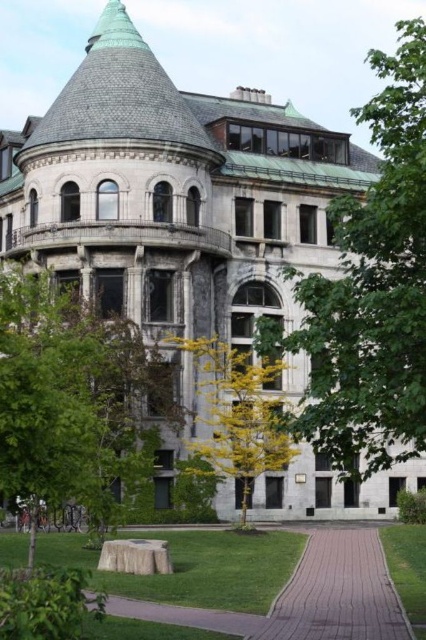
Question: Can you confirm if brick paved path at center is bigger than yellow-green leaves at center?

Choices:
 (A) yes
 (B) no

Answer: (B)

Question: Does brick paved path at center have a smaller size compared to yellow-green leaves at center?

Choices:
 (A) no
 (B) yes

Answer: (B)

Question: Does brick paved path at center appear on the left side of yellow-green leaves at center?

Choices:
 (A) no
 (B) yes

Answer: (A)

Question: Which point appears closest to the camera in this image?

Choices:
 (A) (66, 305)
 (B) (299, 564)
 (C) (244, 419)

Answer: (B)

Question: Which object is the farthest from the green leafy tree at lower left?

Choices:
 (A) green leafy tree at upper center
 (B) yellow-green leaves at center

Answer: (A)

Question: Which point appears closest to the camera in this image?

Choices:
 (A) (196, 368)
 (B) (80, 328)

Answer: (B)